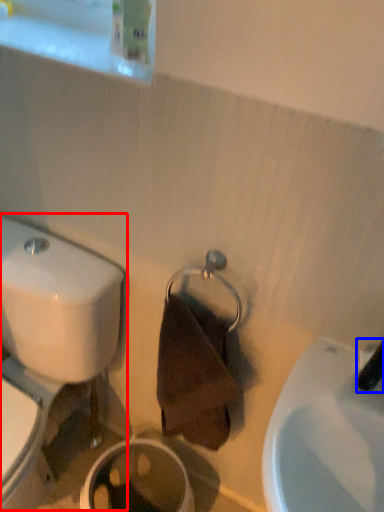
Question: Which object is further to the camera taking this photo, toilet (highlighted by a red box) or plumbing fixture (highlighted by a blue box)?

Choices:
 (A) toilet
 (B) plumbing fixture

Answer: (A)